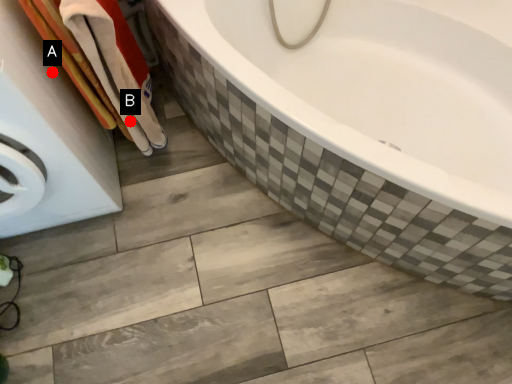
Question: Two points are circled on the image, labeled by A and B beside each circle. Which of the following is the closest to the observer?

Choices:
 (A) A is closer
 (B) B is closer

Answer: (A)